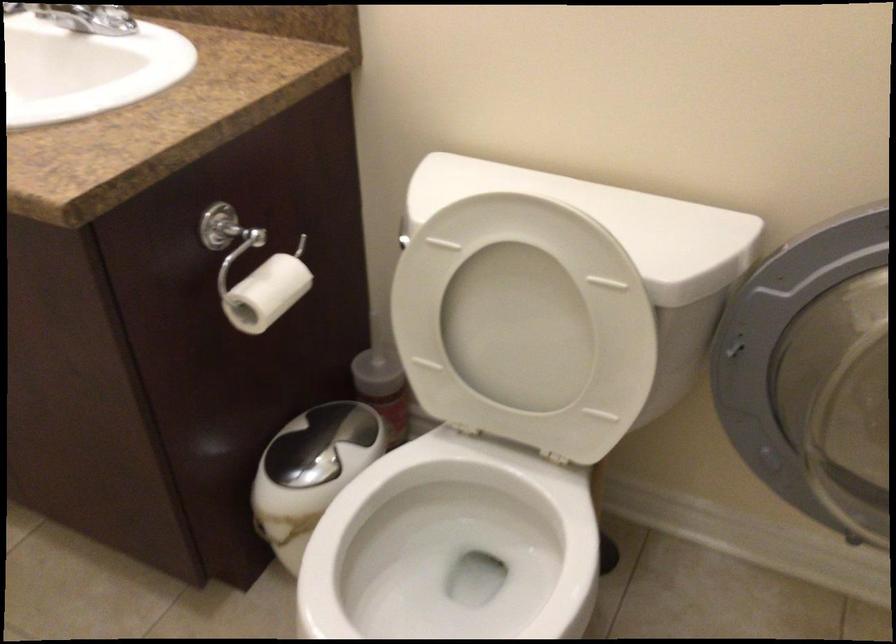
In order to click on white toilet lid in this screenshot , I will do `click(517, 328)`.